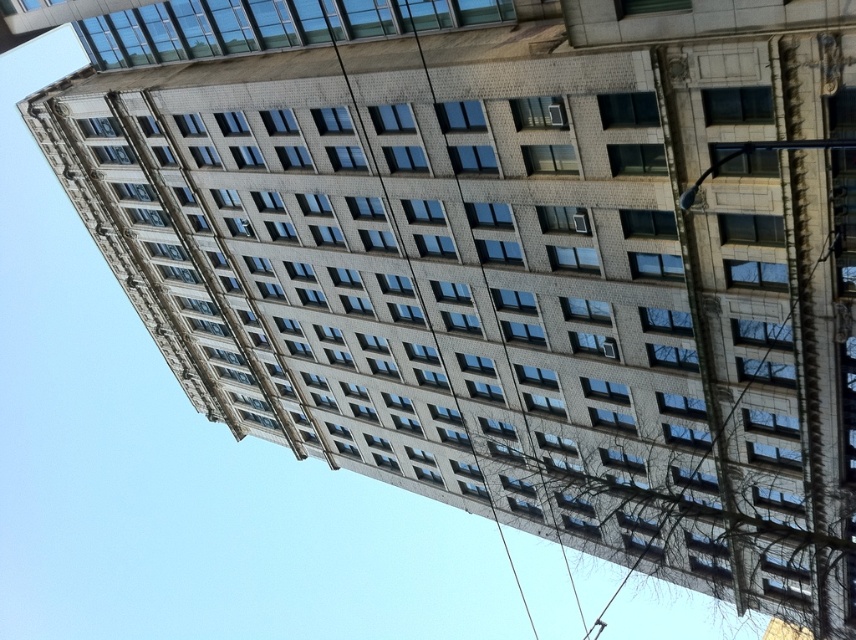
You are an inspector evaluating the building for safety concerns. You notice a point at coordinates (710, 397) on the building facade. What is the object located at this coordinate?

The point at coordinates (710, 397) indicates a metallic wire at upper right.

You are an electrician assessing the building for installation of new cables. You notice two wires present in the image. Which wire is closer to the ground floor, the metallic wire at upper right or the smooth wire at center?

The metallic wire at upper right has a lesser height compared to the smooth wire at center, so the metallic wire at upper right is closer to the ground floor.